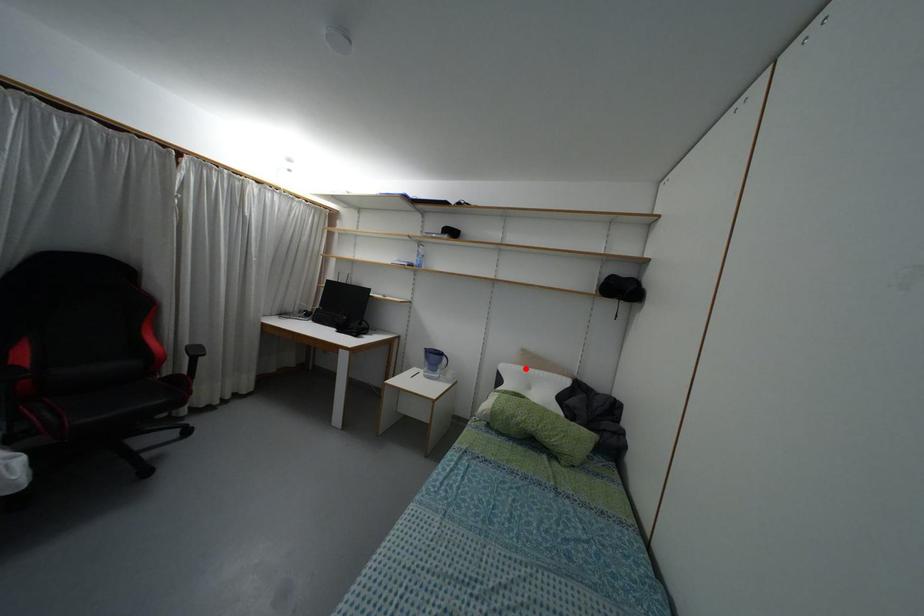
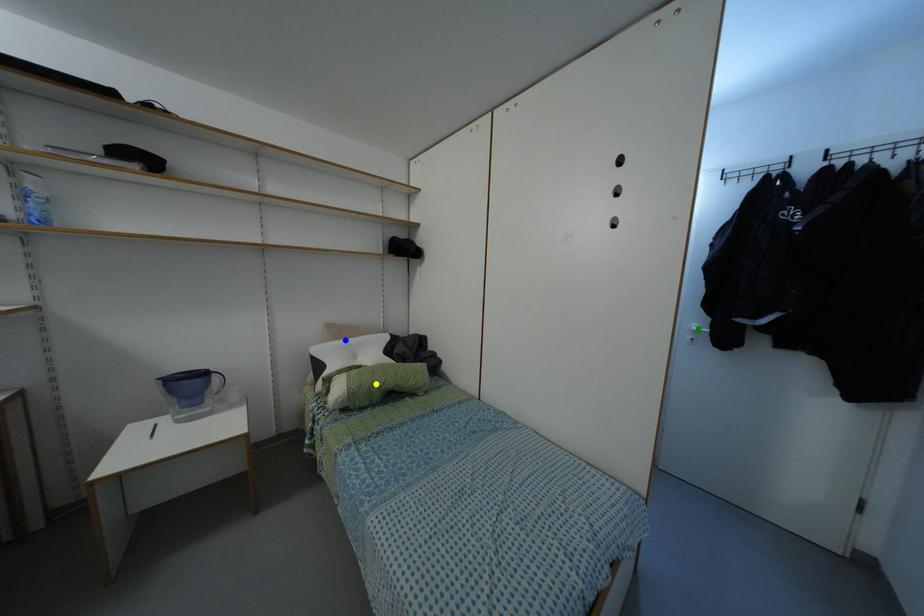
Question: I am providing you with two images of the same scene from different viewpoints. A red point is marked on the first image. You are given multiple points on the second image. Which point in image 2 represents the same 3d spot as the red point in image 1?

Choices:
 (A) green point
 (B) yellow point
 (C) blue point

Answer: (C)